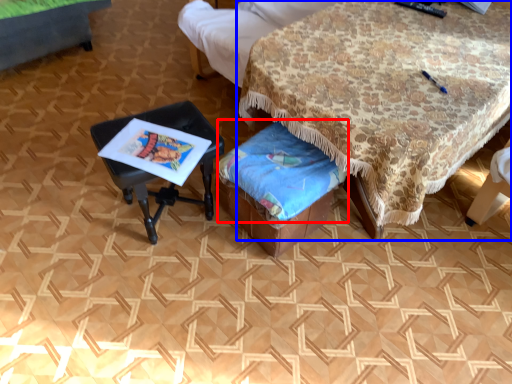
Question: Among these objects, which one is farthest to the camera, blanket (highlighted by a red box) or table (highlighted by a blue box)?

Choices:
 (A) blanket
 (B) table

Answer: (A)